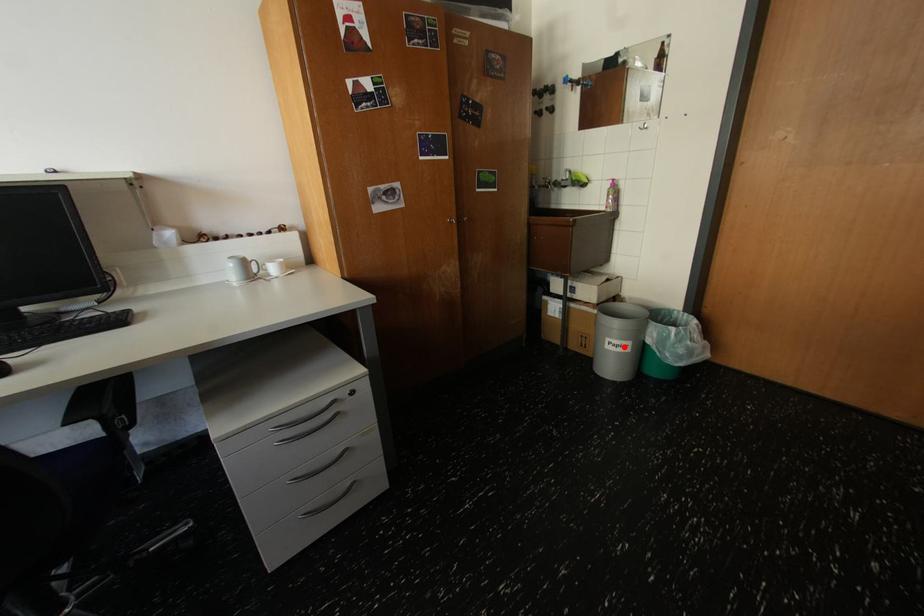
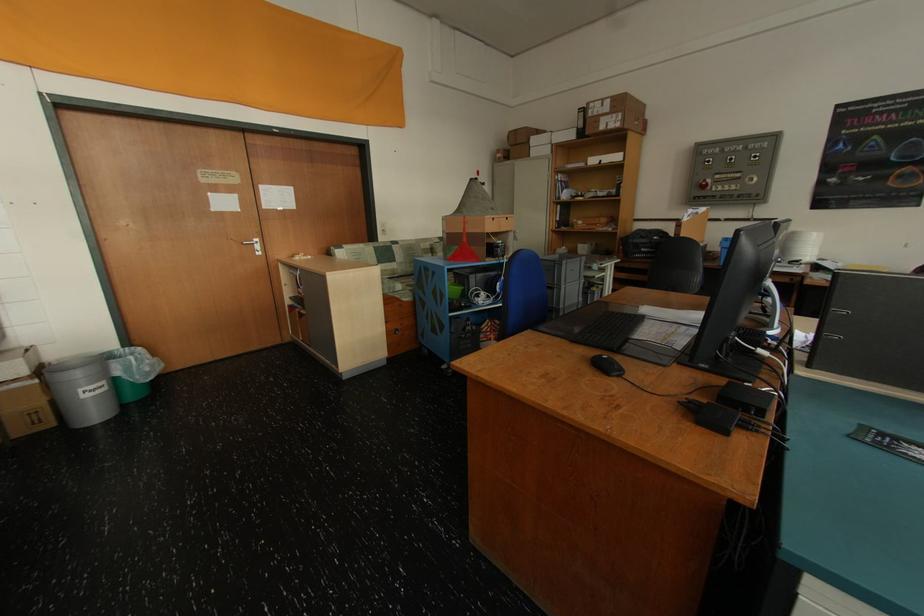
Find the pixel in the second image that matches the highlighted location in the first image.

(101, 392)